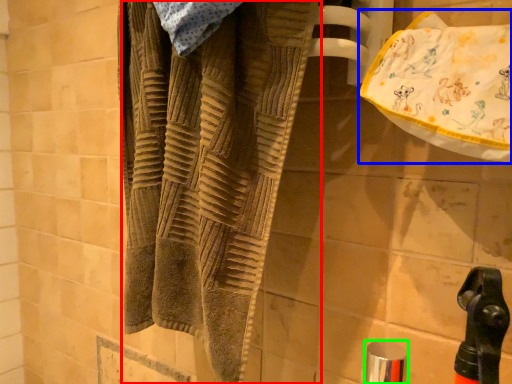
Question: Estimate the real-world distances between objects in this image. Which object is closer to towel (highlighted by a red box), beach towel (highlighted by a blue box) or faucet (highlighted by a green box)?

Choices:
 (A) beach towel
 (B) faucet

Answer: (A)